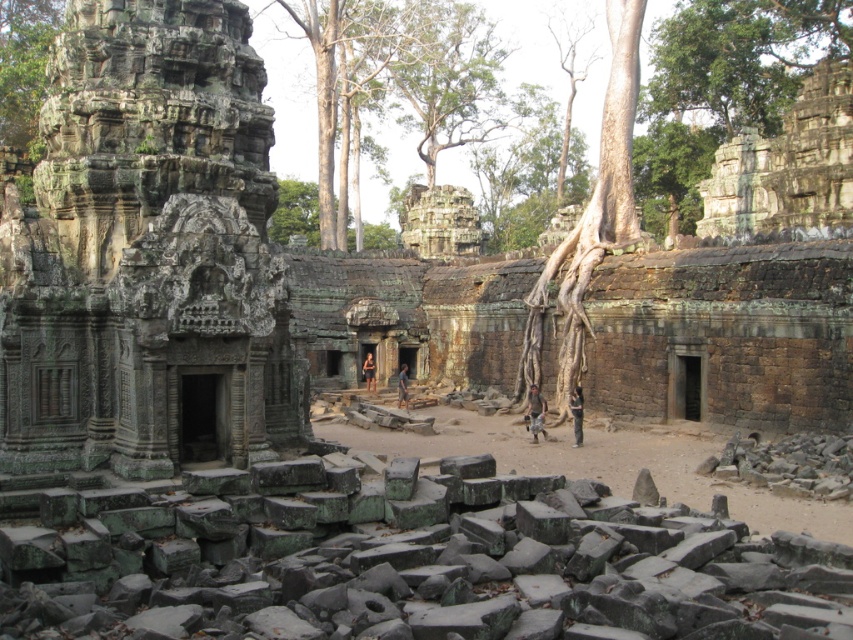
Does green stone temple at center have a greater width compared to green mossy tree at upper left?

In fact, green stone temple at center might be narrower than green mossy tree at upper left.

Can you confirm if green stone temple at center is positioned to the right of green mossy tree at upper left?

Yes, green stone temple at center is to the right of green mossy tree at upper left.

This screenshot has width=853, height=640. Identify the location of green stone temple at center. (148, 253).

Can you confirm if green stone wall at upper right is positioned to the left of green mossy tree at upper left?

No, green stone wall at upper right is not to the left of green mossy tree at upper left.

Does green stone wall at upper right appear over green mossy tree at upper left?

No.

Which is behind, point (788, 140) or point (61, 3)?

The point (61, 3) is more distant.

Locate an element on the screen. The height and width of the screenshot is (640, 853). green stone wall at upper right is located at coordinates (787, 164).

Who is positioned more to the left, green stone at center or green stone wall at upper right?

From the viewer's perspective, green stone at center appears more on the left side.

Which is in front, point (392, 586) or point (799, 218)?

Positioned in front is point (392, 586).

Image resolution: width=853 pixels, height=640 pixels. I want to click on green stone at center, so click(412, 563).